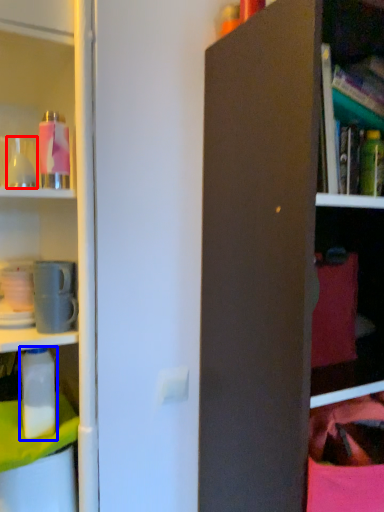
Question: Among these objects, which one is farthest to the camera, bottle (highlighted by a red box) or bottle (highlighted by a blue box)?

Choices:
 (A) bottle
 (B) bottle

Answer: (B)